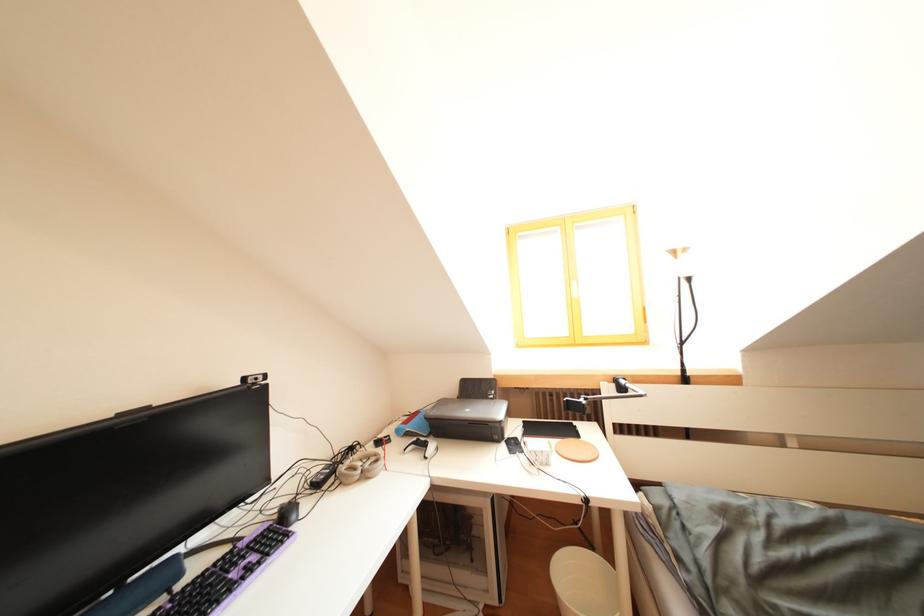
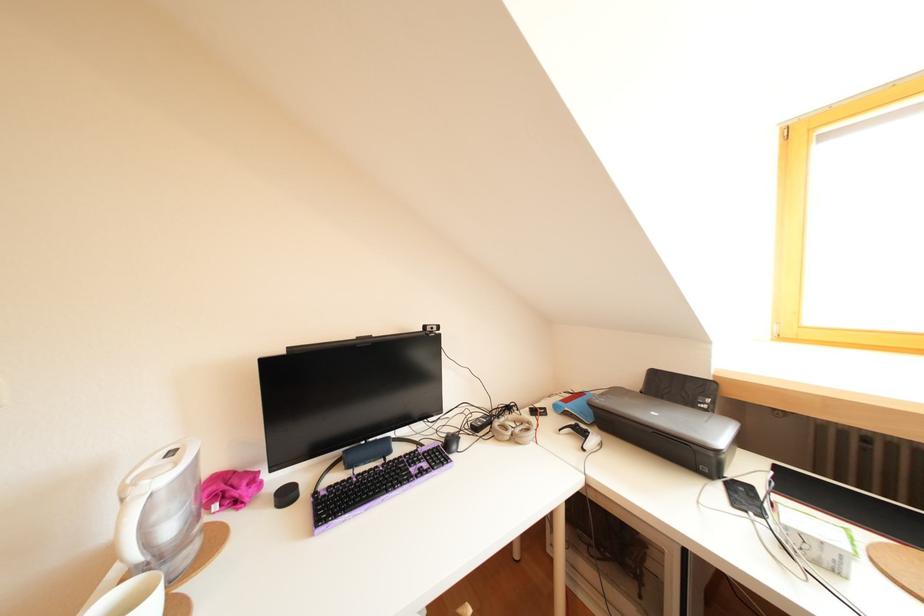
In the second image, find the point that corresponds to the point at 359,454 in the first image.

(516, 413)